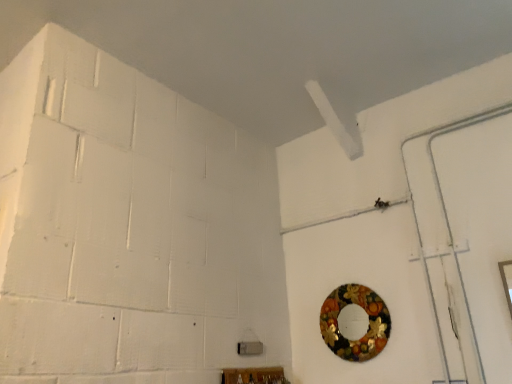
Image resolution: width=512 pixels, height=384 pixels. What do you see at coordinates (355, 322) in the screenshot?
I see `gold textured mirror at lower right` at bounding box center [355, 322].

In order to click on gold textured mirror at lower right in this screenshot , I will do `click(355, 322)`.

Locate an element on the screen. gold textured mirror at lower right is located at coordinates (355, 322).